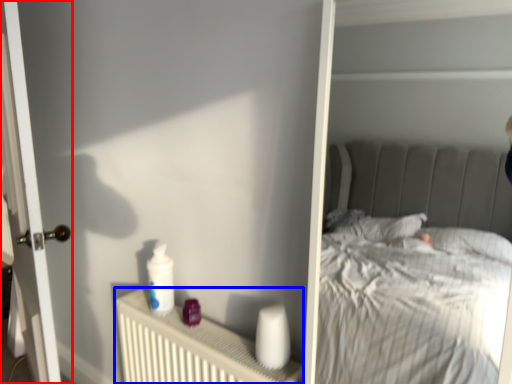
Question: Which object is further to the camera taking this photo, door (highlighted by a red box) or radiator (highlighted by a blue box)?

Choices:
 (A) door
 (B) radiator

Answer: (A)